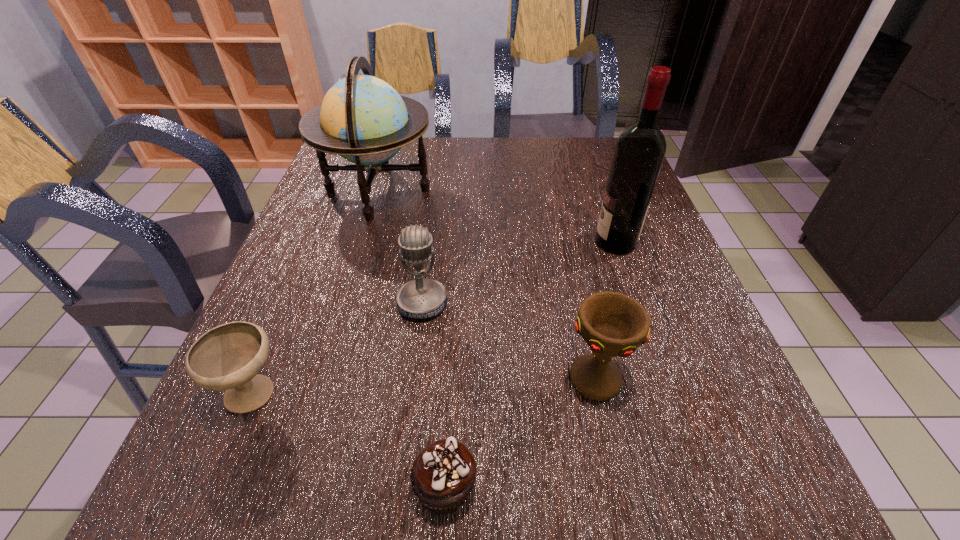
Identify the location of object located in the far edge section of the desktop. The width and height of the screenshot is (960, 540). (362, 118).

Where is `object present at the near edge`? This screenshot has height=540, width=960. object present at the near edge is located at coordinates (442, 476).

This screenshot has width=960, height=540. What are the coordinates of `globe that is at the left edge` in the screenshot? It's located at (362, 118).

Image resolution: width=960 pixels, height=540 pixels. Identify the location of chalice that is at the left edge. (228, 357).

This screenshot has height=540, width=960. I want to click on object that is at the right edge, so click(639, 152).

This screenshot has width=960, height=540. I want to click on object that is positioned at the far left corner, so click(x=362, y=118).

Locate an element on the screen. vacant space at the far edge of the desktop is located at coordinates (544, 172).

The height and width of the screenshot is (540, 960). I want to click on free region at the near edge, so click(593, 501).

In the image, there is a desktop. Where is `free region at the left edge`? This screenshot has width=960, height=540. free region at the left edge is located at coordinates (331, 312).

Identify the location of free space at the right edge of the desktop. (700, 424).